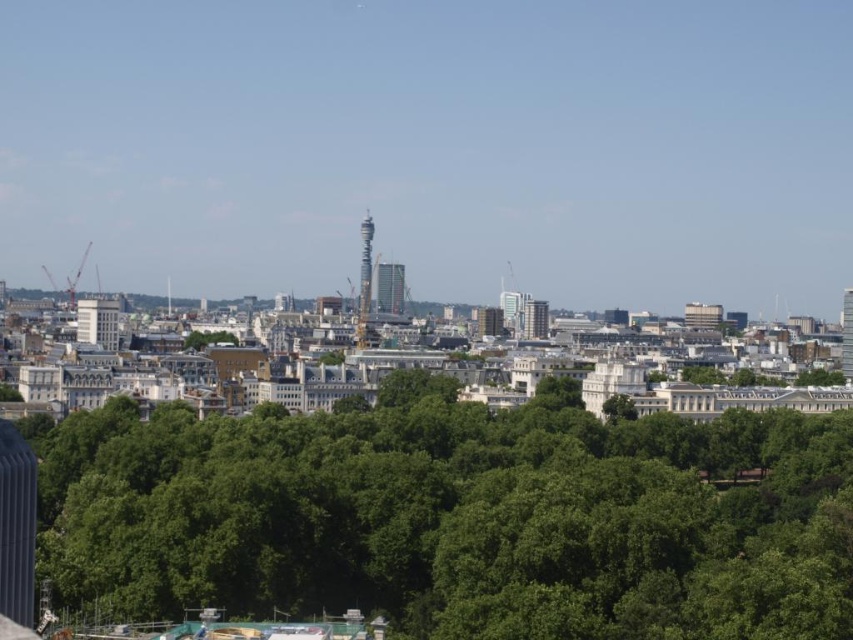
Is green leafy trees at center closer to camera compared to silver metallic tower at center?

Yes, green leafy trees at center is in front of silver metallic tower at center.

Who is positioned more to the left, green leafy trees at center or silver metallic tower at center?

silver metallic tower at center

Between point (177, 480) and point (368, 294), which one is positioned in front?

Point (177, 480) is in front.

In order to click on green leafy trees at center in this screenshot , I will do `click(453, 516)`.

Where is `green leafy trees at center`? This screenshot has width=853, height=640. green leafy trees at center is located at coordinates (453, 516).

Is point (469, 461) positioned in front of point (225, 339)?

Yes, it is in front of point (225, 339).

Which is behind, point (57, 589) or point (234, 336)?

The point (234, 336) is behind.

The width and height of the screenshot is (853, 640). I want to click on green leafy trees at center, so [453, 516].

Who is more forward, (402, 284) or (821, 380)?

Point (821, 380) is in front.

Is point (389, 273) closer to viewer compared to point (836, 380)?

That is False.

This screenshot has width=853, height=640. Identify the location of glassy metallic tower at center. point(389,288).